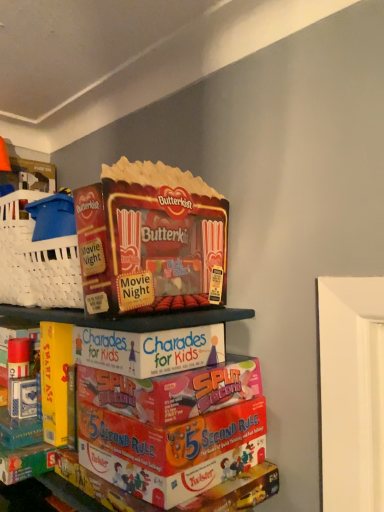
Question: Is cardboard game boxes at center situated inside matte cardboard butterkist popcorn at upper center or outside?

Choices:
 (A) outside
 (B) inside

Answer: (A)

Question: Considering the positions of cardboard game boxes at center and matte cardboard butterkist popcorn at upper center in the image, is cardboard game boxes at center taller or shorter than matte cardboard butterkist popcorn at upper center?

Choices:
 (A) tall
 (B) short

Answer: (A)

Question: Considering the positions of cardboard game boxes at center and matte cardboard butterkist popcorn at upper center in the image, is cardboard game boxes at center wider or thinner than matte cardboard butterkist popcorn at upper center?

Choices:
 (A) thin
 (B) wide

Answer: (A)

Question: In the image, is matte cardboard butterkist popcorn at upper center positioned in front of or behind cardboard game boxes at center?

Choices:
 (A) front
 (B) behind

Answer: (B)

Question: From the image's perspective, is matte cardboard butterkist popcorn at upper center above or below cardboard game boxes at center?

Choices:
 (A) below
 (B) above

Answer: (B)

Question: In terms of width, does matte cardboard butterkist popcorn at upper center look wider or thinner when compared to cardboard game boxes at center?

Choices:
 (A) wide
 (B) thin

Answer: (A)

Question: Is matte cardboard butterkist popcorn at upper center spatially inside cardboard game boxes at center, or outside of it?

Choices:
 (A) inside
 (B) outside

Answer: (B)